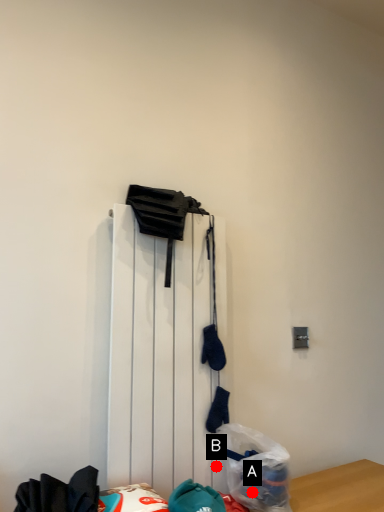
Question: Two points are circled on the image, labeled by A and B beside each circle. Which point is further to the camera?

Choices:
 (A) A is further
 (B) B is further

Answer: (B)